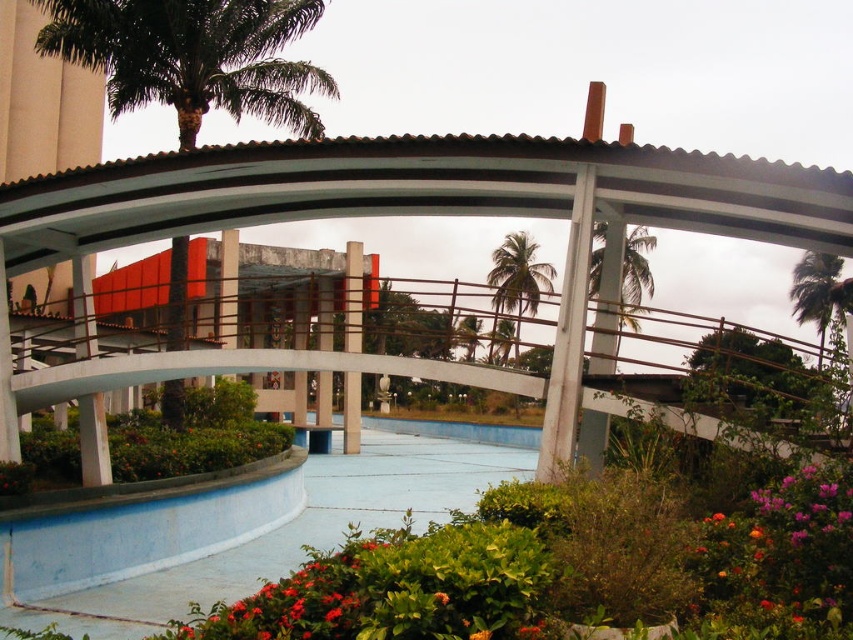
Consider the image. You are an architect designing a new park layout and want to place a bench between the white concrete bridge at center and the green leafy palm tree at upper left. Which object should the bench be closer to if you want it to be near the smaller one?

The bench should be closer to the white concrete bridge at center because it is smaller than the green leafy palm tree at upper left.